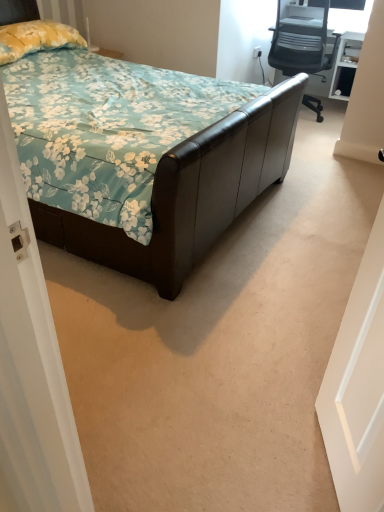
Question: In terms of height, does white matte door at right look taller or shorter compared to white plastic power outlet at upper right?

Choices:
 (A) short
 (B) tall

Answer: (B)

Question: Considering their positions, is white matte door at right located in front of or behind white plastic power outlet at upper right?

Choices:
 (A) front
 (B) behind

Answer: (A)

Question: Which object is positioned farthest from the gray mesh office chair at upper right?

Choices:
 (A) brown leather bed at center
 (B) white plastic power outlet at upper right
 (C) white matte door at right
 (D) yellow floral fabric pillow at upper left

Answer: (C)

Question: Based on their relative distances, which object is farther from the white matte door at right?

Choices:
 (A) gray mesh office chair at upper right
 (B) brown leather bed at center
 (C) white plastic power outlet at upper right
 (D) yellow floral fabric pillow at upper left

Answer: (C)